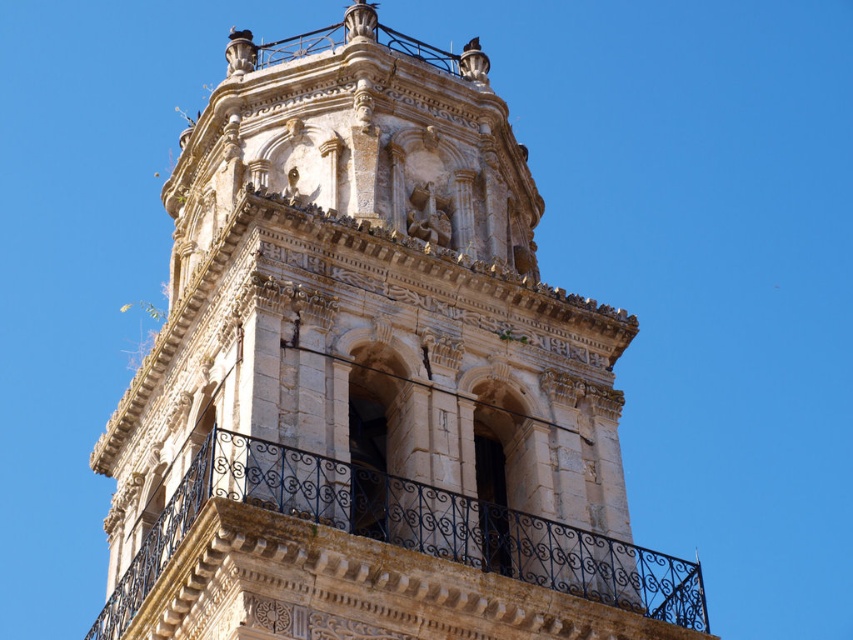
You are a maintenance worker needing to access the black wrought iron balcony at center for repairs. The white stone tower at center is in the way. Can you safely reach the balcony without climbing the tower?

The white stone tower at center is positioned over the black wrought iron balcony at center, so you can safely access the balcony by approaching it from the side or below, avoiding the tower.

Based on the photo, you are standing at the base of the historic bell tower and want to take a photo of the point at coordinate point (467, 614). If your camera has a focal length of 50mm and you are 38.40 meters away from the point, what is the approximate angle of view required to capture the point in the center of your photo?

The point at coordinate point (467, 614) is 38.40 meters away from the viewer. Using the formula for angle of view, the required angle can be calculated to ensure the point is centered in the photo.

You are an architect assessing the structural integrity of the white stone tower at center and the black wrought iron balcony at center. Which structure has a larger surface area?

The white stone tower at center has a larger surface area than the black wrought iron balcony at center, as it is bigger in size according to the description.